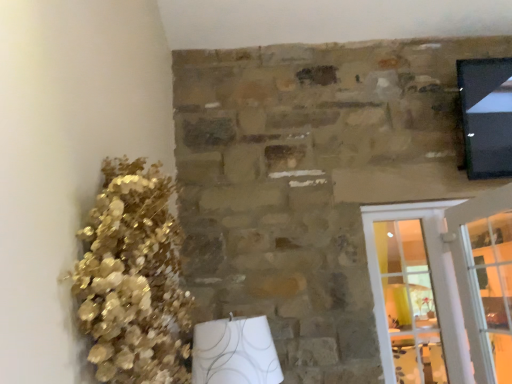
Question: Should I look upward or downward to see white glass screen door at right?

Choices:
 (A) down
 (B) up

Answer: (A)

Question: Is white glass screen door at right shorter than gold metallic floral arrangement at left?

Choices:
 (A) yes
 (B) no

Answer: (B)

Question: Is gold metallic floral arrangement at left surrounded by white glass screen door at right?

Choices:
 (A) no
 (B) yes

Answer: (A)

Question: Considering the relative sizes of white glass screen door at right and gold metallic floral arrangement at left in the image provided, is white glass screen door at right wider than gold metallic floral arrangement at left?

Choices:
 (A) yes
 (B) no

Answer: (B)

Question: Considering the relative sizes of white glass screen door at right and gold metallic floral arrangement at left in the image provided, is white glass screen door at right thinner than gold metallic floral arrangement at left?

Choices:
 (A) yes
 (B) no

Answer: (A)

Question: From the image's perspective, would you say white glass screen door at right is shown under gold metallic floral arrangement at left?

Choices:
 (A) no
 (B) yes

Answer: (B)

Question: Is white glass screen door at right next to gold metallic floral arrangement at left?

Choices:
 (A) no
 (B) yes

Answer: (A)

Question: Is gold metallic floral arrangement at left positioned beyond the bounds of white glass screen door at right?

Choices:
 (A) yes
 (B) no

Answer: (A)

Question: Is white glass screen door at right at the back of gold metallic floral arrangement at left?

Choices:
 (A) yes
 (B) no

Answer: (B)

Question: Is gold metallic floral arrangement at left facing towards white glass screen door at right?

Choices:
 (A) yes
 (B) no

Answer: (B)

Question: Is the depth of gold metallic floral arrangement at left less than that of white glass screen door at right?

Choices:
 (A) yes
 (B) no

Answer: (A)

Question: From a real-world perspective, is gold metallic floral arrangement at left located beneath white glass screen door at right?

Choices:
 (A) no
 (B) yes

Answer: (A)

Question: From the image's perspective, is gold metallic floral arrangement at left above white glass screen door at right?

Choices:
 (A) no
 (B) yes

Answer: (B)

Question: Is clear glass door at lower right completely or partially outside of white glass screen door at right?

Choices:
 (A) yes
 (B) no

Answer: (A)